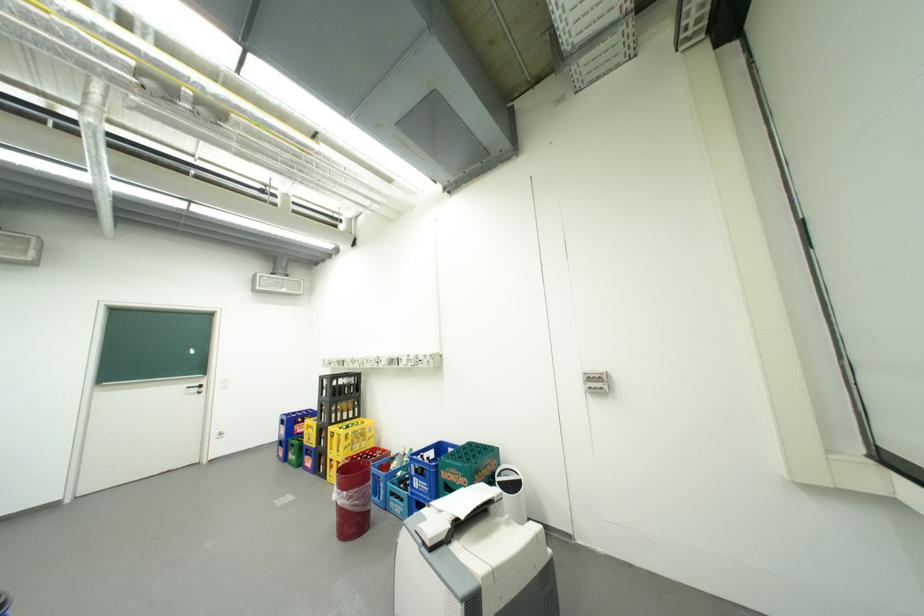
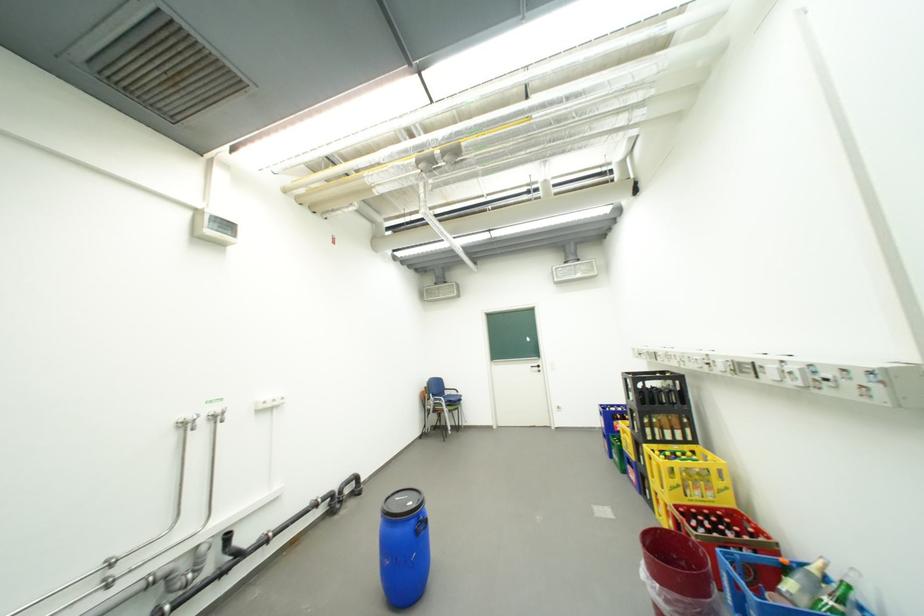
Question: The camera is either moving clockwise (left) or counter-clockwise (right) around the object. The first image is from the beginning of the video and the second image is from the end. Is the camera moving left or right when shooting the video?

Choices:
 (A) Left
 (B) Right

Answer: (B)